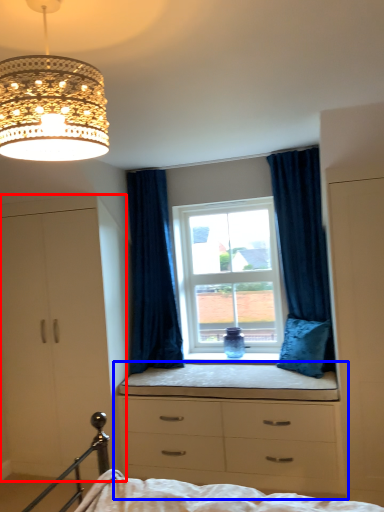
Question: Among these objects, which one is nearest to the camera, dresser (highlighted by a red box) or chest of drawers (highlighted by a blue box)?

Choices:
 (A) dresser
 (B) chest of drawers

Answer: (B)